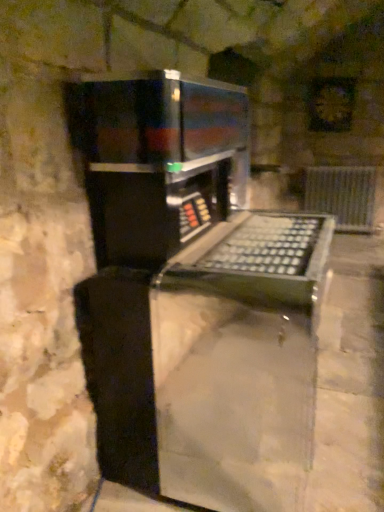
Describe the element at coordinates (342, 195) in the screenshot. I see `metallic silver radiator at right` at that location.

Measure the distance between metallic silver radiator at right and camera.

The distance of metallic silver radiator at right from camera is 4.53 meters.

This screenshot has width=384, height=512. Find the location of `metallic silver radiator at right`. metallic silver radiator at right is located at coordinates (342, 195).

Identify the location of metallic silver radiator at right. (342, 195).